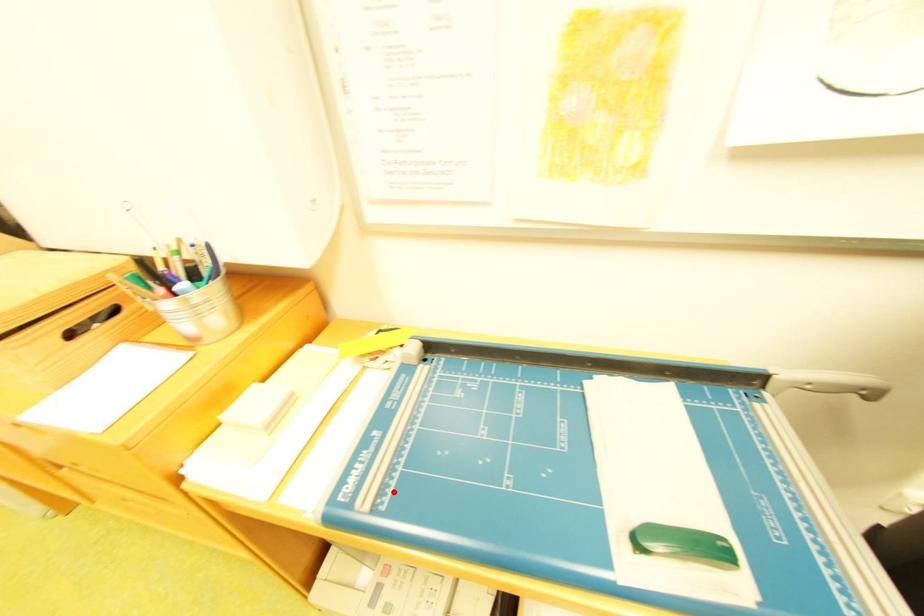
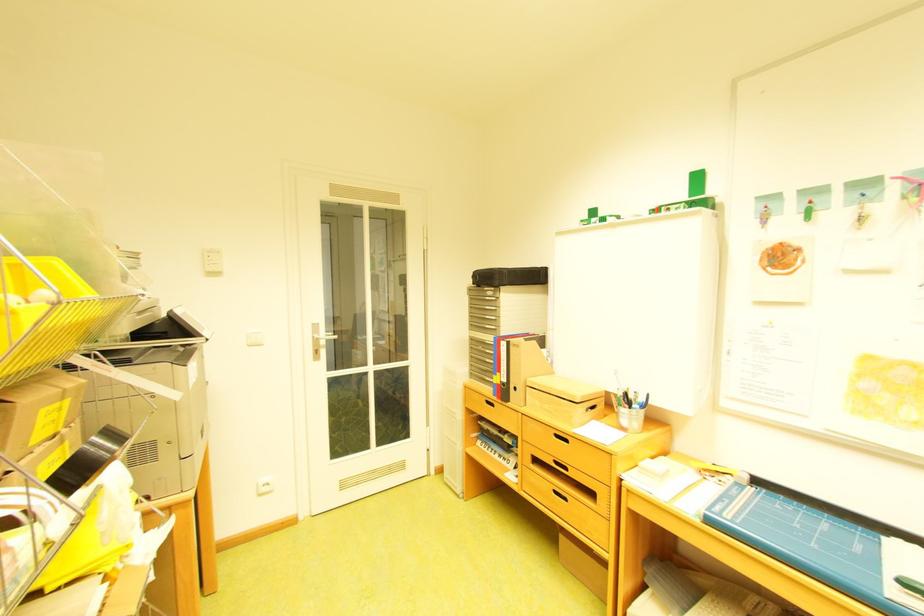
Where in the second image is the point corresponding to the highlighted location from the first image?

(747, 517)